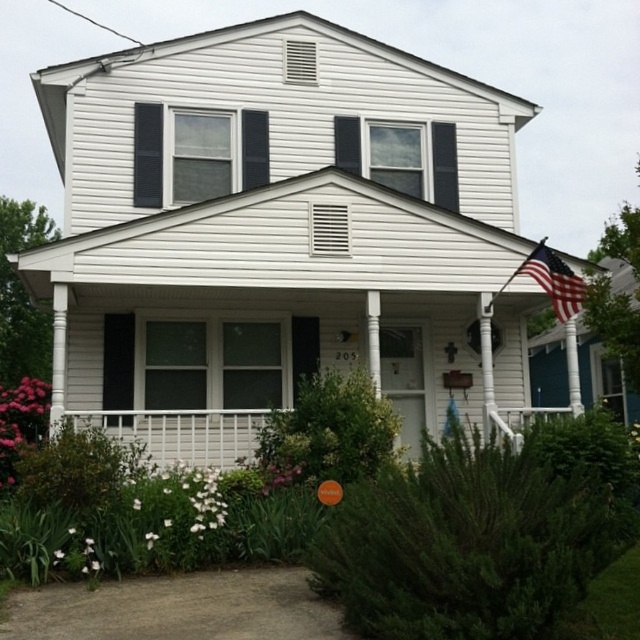
Question: Which of the following is the closest to the observer?

Choices:
 (A) pink matte flower at lower left
 (B) white matte flower at center

Answer: (B)

Question: Among these points, which one is nearest to the camera?

Choices:
 (A) (92, 541)
 (B) (4, 461)
 (C) (547, 268)

Answer: (A)

Question: Can you confirm if pink matte flower at lower left is thinner than american flag at upper right?

Choices:
 (A) no
 (B) yes

Answer: (B)

Question: Estimate the real-world distances between objects in this image. Which object is farther from the white matte flower at center?

Choices:
 (A) pink matte flower at lower left
 (B) american flag at upper right

Answer: (B)

Question: In this image, where is american flag at upper right located relative to white matte flower at center?

Choices:
 (A) right
 (B) left

Answer: (A)

Question: Does pink matte flower at lower left have a smaller size compared to american flag at upper right?

Choices:
 (A) yes
 (B) no

Answer: (A)